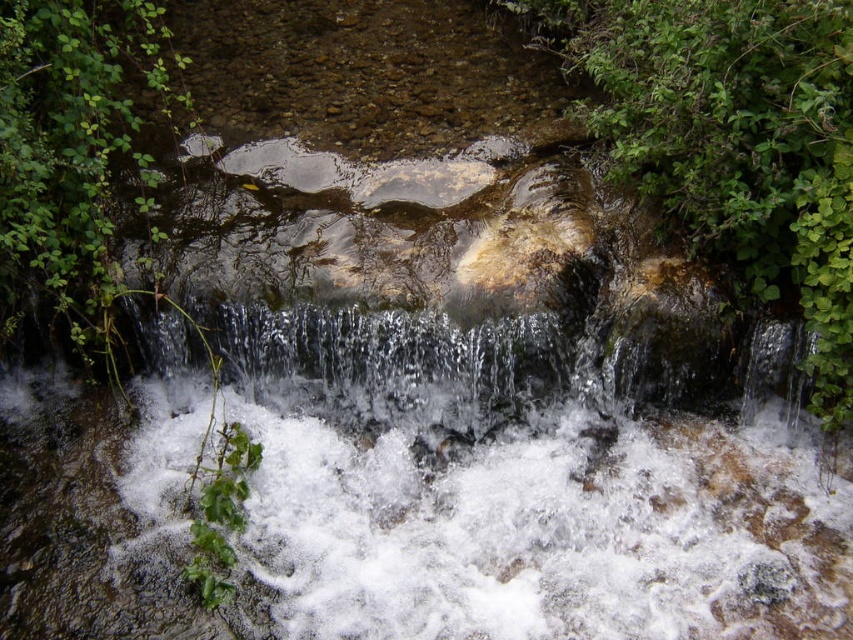
Between green leafy plant at center right and clear water at center, which one appears on the left side from the viewer's perspective?

clear water at center is more to the left.

Is green leafy plant at center right positioned behind clear water at center?

No, it is in front of clear water at center.

Between point (643, 156) and point (549, 326), which one is positioned behind?

The point (549, 326) is behind.

Locate an element on the screen. The image size is (853, 640). green leafy plant at center right is located at coordinates (734, 145).

Between point (149, 186) and point (786, 376), which one is positioned behind?

Positioned behind is point (149, 186).

Which of these two, green leafy plant at left or clear water at center, stands shorter?

Standing shorter between the two is clear water at center.

Who is more distant from viewer, (109, 252) or (541, 394)?

Point (109, 252)

Identify the location of green leafy plant at left. (74, 150).

Who is more distant from viewer, (566, 6) or (44, 61)?

Point (566, 6)

Identify the location of green leafy plant at center right. The width and height of the screenshot is (853, 640). (734, 145).

Does point (844, 406) come farther from viewer compared to point (119, 88)?

No.

Where is `green leafy plant at center right`? The height and width of the screenshot is (640, 853). green leafy plant at center right is located at coordinates (734, 145).